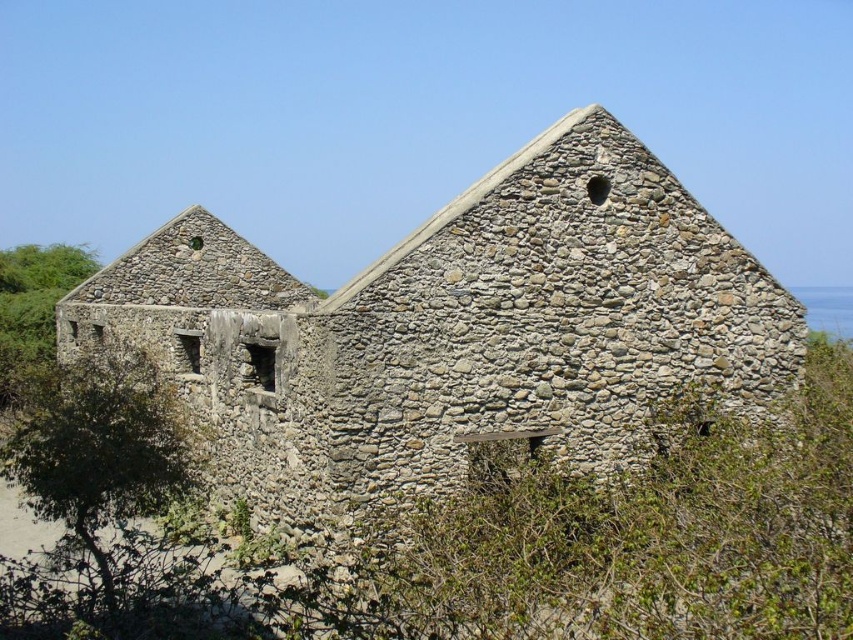
Consider the image. You are standing in front of the old stone buildings and notice a green leafy tree at lower left and a green leafy bush at left. Which one is narrower?

The green leafy tree at lower left is narrower than the green leafy bush at left.

You are standing in front of the gray stone building at center and want to plant a new tree next to the green leafy tree at lower left. Considering the space between them, can you estimate if there is enough room for the new tree?

The gray stone building at center might be wider than the green leafy tree at lower left, so there may not be enough space for the new tree. It is recommended to measure the distance between them first.

You are standing at a viewpoint 50 meters away from the two stone structures. You want to take a photo of the point at coordinates point (523, 416). Will you be able to capture this point in your photo if your camera has a maximum zoom range of 25 meters?

The distance of point (523, 416) from camera is 35.02 meters, which exceeds the camera maximum zoom range of 25 meters. Therefore, you cannot capture the point in your photo.